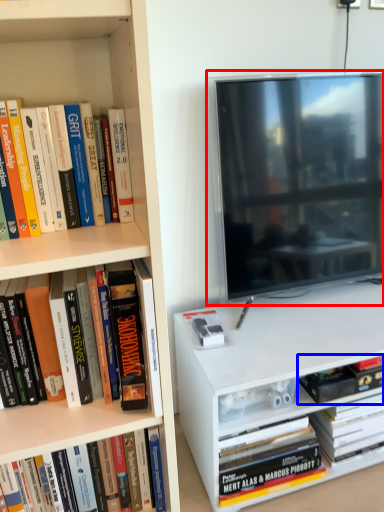
Question: Among these objects, which one is farthest to the camera, television (highlighted by a red box) or book (highlighted by a blue box)?

Choices:
 (A) television
 (B) book

Answer: (B)